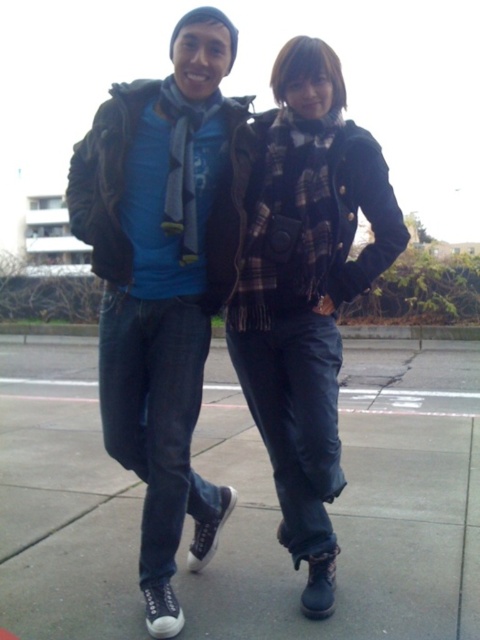
Question: Can you confirm if matte black jacket at center is wider than black rubber shoes at lower center?

Choices:
 (A) yes
 (B) no

Answer: (A)

Question: Can you confirm if matte black jacket at center is thinner than black rubber shoes at lower center?

Choices:
 (A) yes
 (B) no

Answer: (B)

Question: Can you confirm if matte black jacket at center is positioned above black rubber shoes at lower center?

Choices:
 (A) yes
 (B) no

Answer: (A)

Question: Which of the following is the farthest from the observer?

Choices:
 (A) (316, 582)
 (B) (112, 563)

Answer: (B)

Question: Among these points, which one is nearest to the camera?

Choices:
 (A) (266, 536)
 (B) (395, 257)

Answer: (B)